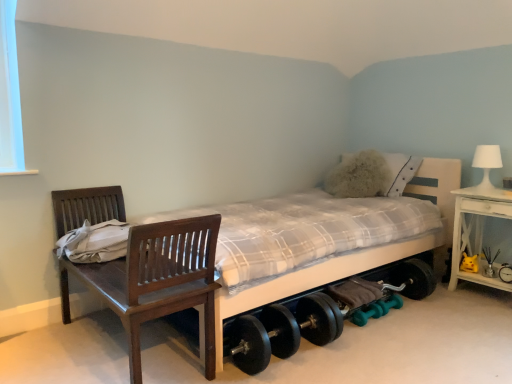
How much space does teal rubber dumbbell at lower center, the third dumbbell when ordered from top to bottom, occupy horizontally?

teal rubber dumbbell at lower center, the third dumbbell when ordered from top to bottom, is 4.06 inches wide.

Describe the element at coordinates (156, 280) in the screenshot. This screenshot has width=512, height=384. I see `wooden chair at left` at that location.

Locate an element on the screen. This screenshot has height=384, width=512. wooden chair at left is located at coordinates (156, 280).

Image resolution: width=512 pixels, height=384 pixels. What do you see at coordinates (505, 273) in the screenshot? I see `black rubber dumbbell at lower right, marked as the 3th dumbbell in a left-to-right arrangement` at bounding box center [505, 273].

This screenshot has height=384, width=512. I want to click on white matte table lamp at upper right, so click(486, 165).

From a real-world perspective, is green rubber dumbbell at lower center, the 2th dumbbell positioned from the bottom, beneath black rubber dumbbell at lower right, marked as the 3th dumbbell in a bottom-to-top arrangement?

Yes, from a real-world perspective, green rubber dumbbell at lower center, the 2th dumbbell positioned from the bottom, is beneath black rubber dumbbell at lower right, marked as the 3th dumbbell in a bottom-to-top arrangement.

Which is correct: green rubber dumbbell at lower center, the 2th dumbbell positioned from the bottom, is inside black rubber dumbbell at lower right, acting as the 1th dumbbell starting from the right, or outside of it?

green rubber dumbbell at lower center, the 2th dumbbell positioned from the bottom, is not enclosed by black rubber dumbbell at lower right, acting as the 1th dumbbell starting from the right.

Is green rubber dumbbell at lower center, positioned as the 2th dumbbell in top-to-bottom order, to the right of black rubber dumbbell at lower right, marked as the 3th dumbbell in a bottom-to-top arrangement, from the viewer's perspective?

Incorrect, green rubber dumbbell at lower center, positioned as the 2th dumbbell in top-to-bottom order, is not on the right side of black rubber dumbbell at lower right, marked as the 3th dumbbell in a bottom-to-top arrangement.

Who is smaller, green rubber dumbbell at lower center, the 2th dumbbell from the right, or black rubber dumbbell at lower right, marked as the 3th dumbbell in a left-to-right arrangement?

With smaller size is black rubber dumbbell at lower right, marked as the 3th dumbbell in a left-to-right arrangement.

Can you confirm if teal rubber dumbbell at lower center, the third dumbbell when ordered from top to bottom, is bigger than wooden chair at left?

No, teal rubber dumbbell at lower center, the third dumbbell when ordered from top to bottom, is not bigger than wooden chair at left.

Does teal rubber dumbbell at lower center, acting as the 1th dumbbell starting from the bottom, have a greater height compared to wooden chair at left?

Incorrect, the height of teal rubber dumbbell at lower center, acting as the 1th dumbbell starting from the bottom, is not larger of that of wooden chair at left.

From a real-world perspective, is teal rubber dumbbell at lower center, which is counted as the third dumbbell, starting from the right, below wooden chair at left?

Yes, from a real-world perspective, teal rubber dumbbell at lower center, which is counted as the third dumbbell, starting from the right, is below wooden chair at left.

Between teal rubber dumbbell at lower center, which is counted as the third dumbbell, starting from the right, and wooden chair at left, which one is positioned behind?

teal rubber dumbbell at lower center, which is counted as the third dumbbell, starting from the right, is further from the camera.

How much distance is there between green rubber dumbbell at lower center, the 2th dumbbell positioned from the bottom, and yellow plush toy at lower right?

26.43 inches.

Considering the points (397, 299) and (460, 264), which point is behind, point (397, 299) or point (460, 264)?

The point (460, 264) is farther.

How many degrees apart are the facing directions of green rubber dumbbell at lower center, the 2th dumbbell in the left-to-right sequence, and yellow plush toy at lower right?

green rubber dumbbell at lower center, the 2th dumbbell in the left-to-right sequence, and yellow plush toy at lower right are facing 88.7 degrees away from each other.

Is green rubber dumbbell at lower center, the 2th dumbbell in the left-to-right sequence, oriented away from yellow plush toy at lower right?

No, green rubber dumbbell at lower center, the 2th dumbbell in the left-to-right sequence, is not facing away from yellow plush toy at lower right.

Is white plaid fabric bed at center not within black rubber dumbbell at lower right, marked as the 3th dumbbell in a bottom-to-top arrangement?

Indeed, white plaid fabric bed at center is completely outside black rubber dumbbell at lower right, marked as the 3th dumbbell in a bottom-to-top arrangement.

Looking at their sizes, would you say white plaid fabric bed at center is wider or thinner than black rubber dumbbell at lower right, marked as the 3th dumbbell in a left-to-right arrangement?

Considering their sizes, white plaid fabric bed at center looks broader than black rubber dumbbell at lower right, marked as the 3th dumbbell in a left-to-right arrangement.

From the image's perspective, does white plaid fabric bed at center appear lower than black rubber dumbbell at lower right, marked as the 3th dumbbell in a bottom-to-top arrangement?

No.

Looking at this image, which is closer, (222,330) or (508,275)?

Point (222,330) appears to be closer to the viewer than point (508,275).

The width and height of the screenshot is (512, 384). In order to click on dumbbell on the right of white matte table lamp at upper right in this screenshot , I will do `click(505, 273)`.

Who is taller, black rubber dumbbell at lower right, which is the 1th dumbbell from top to bottom, or white matte table lamp at upper right?

With more height is white matte table lamp at upper right.

Does black rubber dumbbell at lower right, which is the 1th dumbbell from top to bottom, have a larger size compared to white matte table lamp at upper right?

No, black rubber dumbbell at lower right, which is the 1th dumbbell from top to bottom, is not bigger than white matte table lamp at upper right.

Is point (507, 275) closer or farther from the camera than point (484, 160)?

Clearly, point (507, 275) is closer to the camera than point (484, 160).

Is wooden chair at left positioned far away from teal rubber dumbbell at lower center, the third dumbbell when ordered from top to bottom?

Absolutely, wooden chair at left is distant from teal rubber dumbbell at lower center, the third dumbbell when ordered from top to bottom.

From the image's perspective, is wooden chair at left under teal rubber dumbbell at lower center, acting as the 1th dumbbell starting from the bottom?

Actually, wooden chair at left appears above teal rubber dumbbell at lower center, acting as the 1th dumbbell starting from the bottom, in the image.

Which of these two, wooden chair at left or teal rubber dumbbell at lower center, the third dumbbell when ordered from top to bottom, is smaller?

teal rubber dumbbell at lower center, the third dumbbell when ordered from top to bottom, is smaller.

Is point (113, 276) farther from camera compared to point (358, 311)?

No, it is not.

Are white wood nightstand at right and black rubber dumbbell at lower right, marked as the 3th dumbbell in a bottom-to-top arrangement, located far from each other?

That's not correct — white wood nightstand at right is a little close to black rubber dumbbell at lower right, marked as the 3th dumbbell in a bottom-to-top arrangement.

Is white wood nightstand at right oriented towards black rubber dumbbell at lower right, which is the 1th dumbbell from top to bottom?

Yes.

Is white wood nightstand at right thinner than black rubber dumbbell at lower right, marked as the 3th dumbbell in a left-to-right arrangement?

No, white wood nightstand at right is not thinner than black rubber dumbbell at lower right, marked as the 3th dumbbell in a left-to-right arrangement.

You are a GUI agent. You are given a task and a screenshot of the screen. Output one action in this format:
    pyautogui.click(x=<x>, y=<y>)
    Task: Click on the dumbbell that is behind the green rubber dumbbell at lower center, the 2th dumbbell from the right
    The height and width of the screenshot is (384, 512).
    Given the screenshot: What is the action you would take?
    pyautogui.click(x=505, y=273)

Identify the location of chair on the left of teal rubber dumbbell at lower center, acting as the 1th dumbbell starting from the bottom. (156, 280).

Based on their spatial positions, is yellow plush toy at lower right or green rubber dumbbell at lower center, the 2th dumbbell from the right, closer to white plaid fabric bed at center?

green rubber dumbbell at lower center, the 2th dumbbell from the right, is closer to white plaid fabric bed at center.

From the image, which object appears to be nearer to white matte table lamp at upper right, yellow plush toy at lower right or wooden chair at left?

yellow plush toy at lower right is closer to white matte table lamp at upper right.

Estimate the real-world distances between objects in this image. Which object is closer to white matte table lamp at upper right, wooden chair at left or teal rubber dumbbell at lower center, acting as the 1th dumbbell starting from the bottom?

teal rubber dumbbell at lower center, acting as the 1th dumbbell starting from the bottom.

Which object lies nearer to the anchor point white wood nightstand at right, green rubber dumbbell at lower center, the 2th dumbbell in the left-to-right sequence, or wooden chair at left?

The object closer to white wood nightstand at right is green rubber dumbbell at lower center, the 2th dumbbell in the left-to-right sequence.

Based on the photo, based on their spatial positions, is green rubber dumbbell at lower center, the 2th dumbbell from the right, or yellow plush toy at lower right closer to teal rubber dumbbell at lower center, the third dumbbell when ordered from top to bottom?

The object closer to teal rubber dumbbell at lower center, the third dumbbell when ordered from top to bottom, is green rubber dumbbell at lower center, the 2th dumbbell from the right.

Which object lies nearer to the anchor point white matte table lamp at upper right, teal rubber dumbbell at lower center, the third dumbbell when ordered from top to bottom, or white plaid fabric bed at center?

The object closer to white matte table lamp at upper right is white plaid fabric bed at center.

Based on their spatial positions, is white plaid fabric bed at center or black rubber dumbbell at lower right, acting as the 1th dumbbell starting from the right, further from teal rubber dumbbell at lower center, the 1th dumbbell viewed from the left?

black rubber dumbbell at lower right, acting as the 1th dumbbell starting from the right, is positioned further to the anchor teal rubber dumbbell at lower center, the 1th dumbbell viewed from the left.

Considering their positions, is black rubber dumbbell at lower right, marked as the 3th dumbbell in a left-to-right arrangement, positioned closer to white plaid fabric bed at center than green rubber dumbbell at lower center, the 2th dumbbell from the right?

green rubber dumbbell at lower center, the 2th dumbbell from the right, is closer to white plaid fabric bed at center.

You are a GUI agent. You are given a task and a screenshot of the screen. Output one action in this format:
    pyautogui.click(x=<x>, y=<y>)
    Task: Click on the toy between white plaid fabric bed at center and white wood nightstand at right in the horizontal direction
    
    Given the screenshot: What is the action you would take?
    pyautogui.click(x=469, y=263)

You are a GUI agent. You are given a task and a screenshot of the screen. Output one action in this format:
    pyautogui.click(x=<x>, y=<y>)
    Task: Click on the toy between teal rubber dumbbell at lower center, the third dumbbell when ordered from top to bottom, and black rubber dumbbell at lower right, marked as the 3th dumbbell in a bottom-to-top arrangement, from left to right
    This screenshot has width=512, height=384.
    Given the screenshot: What is the action you would take?
    pyautogui.click(x=469, y=263)

At what (x,y) coordinates should I click in order to perform the action: click on toy located between white plaid fabric bed at center and white matte table lamp at upper right in the left-right direction. Please return your answer as a coordinate pair (x, y). Looking at the image, I should click on (469, 263).

The height and width of the screenshot is (384, 512). I want to click on dumbbell situated between wooden chair at left and green rubber dumbbell at lower center, the 2th dumbbell positioned from the bottom, from left to right, so click(369, 313).